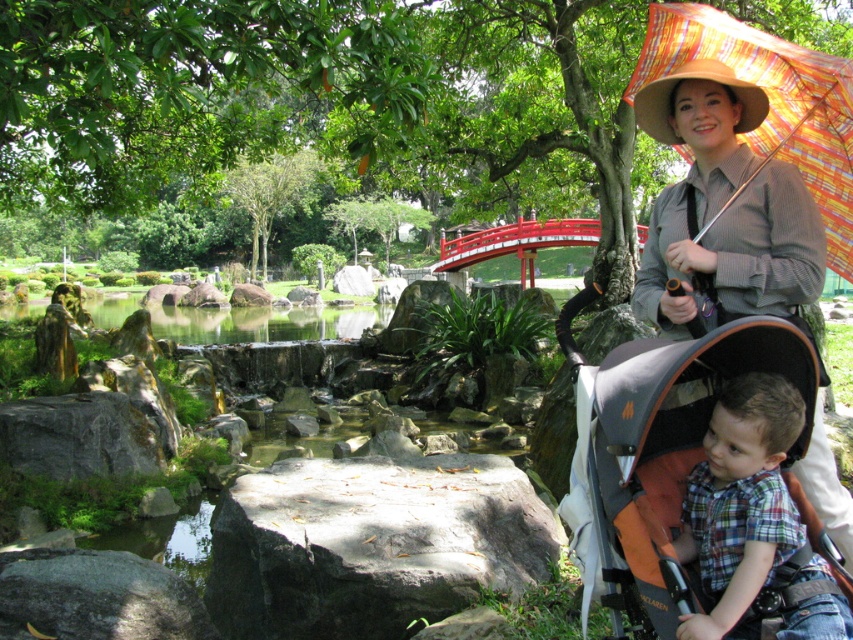
You are a photographer taking a picture of the serene Japanese garden scene. You notice two shirts in the image. The first is a matte brown shirt at upper right and the second is a plaid cotton shirt at lower right. Which shirt is positioned higher in the image?

The matte brown shirt at upper right is positioned higher in the image than the plaid cotton shirt at lower right.

You are a photographer trying to capture a candid shot of the two shirts in the scene. The minimum focus distance your camera can handle is 16 inches. Can you take a photo that includes both the matte brown shirt at upper right and the plaid cotton shirt at lower right without blurring either?

The distance between the matte brown shirt at upper right and plaid cotton shirt at lower right is 16.12 inches. Since this exceeds the camera minimum focus distance of 16 inches, you can take a photo that includes both shirts without blurring either.